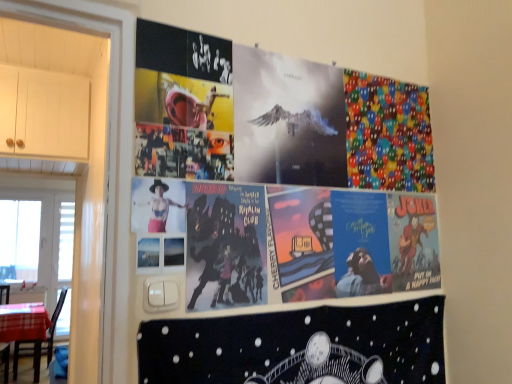
Question: Is colorful fabric pac-man at upper right facing away from white plastic window screen at left, which is the second window screen from back to front?

Choices:
 (A) yes
 (B) no

Answer: (A)

Question: Is colorful fabric pac-man at upper right at the right side of white plastic window screen at left, the 1th window screen positioned from the right?

Choices:
 (A) yes
 (B) no

Answer: (A)

Question: Is colorful fabric pac-man at upper right thinner than white plastic window screen at left, the first window screen viewed from the front?

Choices:
 (A) no
 (B) yes

Answer: (B)

Question: From a real-world perspective, is colorful fabric pac-man at upper right over white plastic window screen at left, which is the second window screen from back to front?

Choices:
 (A) no
 (B) yes

Answer: (B)

Question: Can you confirm if colorful fabric pac-man at upper right is wider than white plastic window screen at left, marked as the 2th window screen in a left-to-right arrangement?

Choices:
 (A) no
 (B) yes

Answer: (A)

Question: Is matte black figure at center inside the boundaries of brown wooden chair at lower left, or outside?

Choices:
 (A) inside
 (B) outside

Answer: (B)

Question: Looking at their shapes, would you say matte black figure at center is wider or thinner than brown wooden chair at lower left?

Choices:
 (A) thin
 (B) wide

Answer: (A)

Question: From the image's perspective, is matte black figure at center above or below brown wooden chair at lower left?

Choices:
 (A) above
 (B) below

Answer: (A)

Question: Based on their positions, is matte black figure at center located to the left or right of brown wooden chair at lower left?

Choices:
 (A) left
 (B) right

Answer: (B)

Question: Looking at their shapes, would you say white plastic window screen at left, the 1th window screen positioned from the right, is wider or thinner than black matte poster at lower center?

Choices:
 (A) thin
 (B) wide

Answer: (B)

Question: From their relative heights in the image, would you say white plastic window screen at left, the first window screen viewed from the front, is taller or shorter than black matte poster at lower center?

Choices:
 (A) short
 (B) tall

Answer: (B)

Question: Considering the relative positions of white plastic window screen at left, marked as the 2th window screen in a left-to-right arrangement, and black matte poster at lower center in the image provided, is white plastic window screen at left, marked as the 2th window screen in a left-to-right arrangement, to the left or to the right of black matte poster at lower center?

Choices:
 (A) right
 (B) left

Answer: (B)

Question: Considering the positions of white plastic window screen at left, which is the second window screen from back to front, and black matte poster at lower center in the image, is white plastic window screen at left, which is the second window screen from back to front, bigger or smaller than black matte poster at lower center?

Choices:
 (A) big
 (B) small

Answer: (A)

Question: Considering the positions of brown wooden chair at lower left and black matte poster at lower center in the image, is brown wooden chair at lower left taller or shorter than black matte poster at lower center?

Choices:
 (A) tall
 (B) short

Answer: (A)

Question: Considering the positions of point (15, 367) and point (305, 377), is point (15, 367) closer or farther from the camera than point (305, 377)?

Choices:
 (A) closer
 (B) farther

Answer: (B)